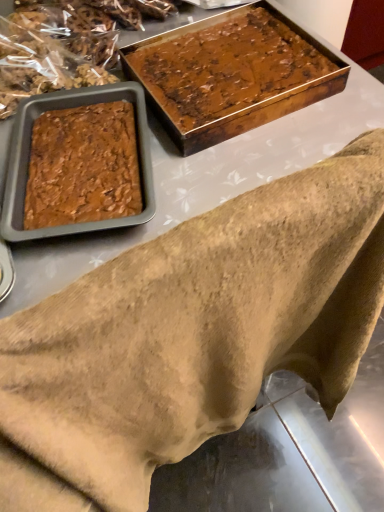
The image size is (384, 512). Describe the element at coordinates (191, 335) in the screenshot. I see `brown fuzzy blanket at lower left` at that location.

Where is `brown fuzzy blanket at lower left`? The image size is (384, 512). brown fuzzy blanket at lower left is located at coordinates (191, 335).

What do you see at coordinates (229, 69) in the screenshot?
I see `shiny brown cake at upper right` at bounding box center [229, 69].

Measure the distance between shiny brown cake at upper right and camera.

shiny brown cake at upper right is 67.88 centimeters away from camera.

The height and width of the screenshot is (512, 384). I want to click on shiny brown cake at upper right, so click(229, 69).

This screenshot has height=512, width=384. In order to click on brown fuzzy blanket at lower left in this screenshot , I will do `click(191, 335)`.

Is shiny brown cake at upper right to the left or to the right of brown fuzzy blanket at lower left in the image?

In the image, shiny brown cake at upper right appears on the right side of brown fuzzy blanket at lower left.

Does shiny brown cake at upper right come in front of brown fuzzy blanket at lower left?

No, it is behind brown fuzzy blanket at lower left.

Is point (237, 23) more distant than point (223, 207)?

That is True.

From the image's perspective, between shiny brown cake at upper right and brown fuzzy blanket at lower left, which one is located above?

From the image's view, shiny brown cake at upper right is above.

From a real-world perspective, which is physically above, shiny brown cake at upper right or brown fuzzy blanket at lower left?

From a 3D spatial view, shiny brown cake at upper right is above.

Between shiny brown cake at upper right and brown fuzzy blanket at lower left, which one has smaller width?

Thinner between the two is brown fuzzy blanket at lower left.

Who is shorter, shiny brown cake at upper right or brown fuzzy blanket at lower left?

shiny brown cake at upper right is shorter.

Based on their sizes in the image, would you say shiny brown cake at upper right is bigger or smaller than brown fuzzy blanket at lower left?

shiny brown cake at upper right is smaller than brown fuzzy blanket at lower left.

Is shiny brown cake at upper right situated inside brown fuzzy blanket at lower left or outside?

shiny brown cake at upper right lies outside brown fuzzy blanket at lower left.

Is shiny brown cake at upper right far from brown fuzzy blanket at lower left?

shiny brown cake at upper right is near brown fuzzy blanket at lower left, not far away.

Could you tell me if shiny brown cake at upper right is facing brown fuzzy blanket at lower left?

No, shiny brown cake at upper right does not turn towards brown fuzzy blanket at lower left.

What's the angular difference between shiny brown cake at upper right and brown fuzzy blanket at lower left's facing directions?

175 degrees separate the facing orientations of shiny brown cake at upper right and brown fuzzy blanket at lower left.

There is a brown fuzzy blanket at lower left. Find the location of `dessert above it (from a real-world perspective)`. dessert above it (from a real-world perspective) is located at coordinates (229, 69).

Is brown fuzzy blanket at lower left at the right side of shiny brown cake at upper right?

In fact, brown fuzzy blanket at lower left is to the left of shiny brown cake at upper right.

Considering their positions, is brown fuzzy blanket at lower left located in front of or behind shiny brown cake at upper right?

Clearly, brown fuzzy blanket at lower left is in front of shiny brown cake at upper right.

Considering the points (167, 418) and (197, 109), which point is in front, point (167, 418) or point (197, 109)?

The point (167, 418) is closer to the camera.

From the image's perspective, is brown fuzzy blanket at lower left positioned above or below shiny brown cake at upper right?

brown fuzzy blanket at lower left is situated lower than shiny brown cake at upper right in the image.

From a real-world perspective, is brown fuzzy blanket at lower left physically below shiny brown cake at upper right?

Yes, from a real-world perspective, brown fuzzy blanket at lower left is under shiny brown cake at upper right.

Considering the sizes of objects brown fuzzy blanket at lower left and shiny brown cake at upper right in the image provided, who is thinner, brown fuzzy blanket at lower left or shiny brown cake at upper right?

Thinner between the two is brown fuzzy blanket at lower left.

Considering the sizes of objects brown fuzzy blanket at lower left and shiny brown cake at upper right in the image provided, who is shorter, brown fuzzy blanket at lower left or shiny brown cake at upper right?

shiny brown cake at upper right.

Between brown fuzzy blanket at lower left and shiny brown cake at upper right, which one has larger size?

Bigger between the two is brown fuzzy blanket at lower left.

Could shiny brown cake at upper right be considered to be inside brown fuzzy blanket at lower left?

No.

Is brown fuzzy blanket at lower left with shiny brown cake at upper right?

No.

Is shiny brown cake at upper right at the back of brown fuzzy blanket at lower left?

brown fuzzy blanket at lower left is not turned away from shiny brown cake at upper right.

How many degrees apart are the facing directions of brown fuzzy blanket at lower left and shiny brown cake at upper right?

The angle between the facing direction of brown fuzzy blanket at lower left and the facing direction of shiny brown cake at upper right is 175 degrees.

In order to click on dessert lying on the right of brown fuzzy blanket at lower left in this screenshot , I will do `click(229, 69)`.

I want to click on dessert above the brown fuzzy blanket at lower left (from a real-world perspective), so click(x=229, y=69).

Where is `wrap on the left of shiny brown cake at upper right`? The height and width of the screenshot is (512, 384). wrap on the left of shiny brown cake at upper right is located at coordinates (191, 335).